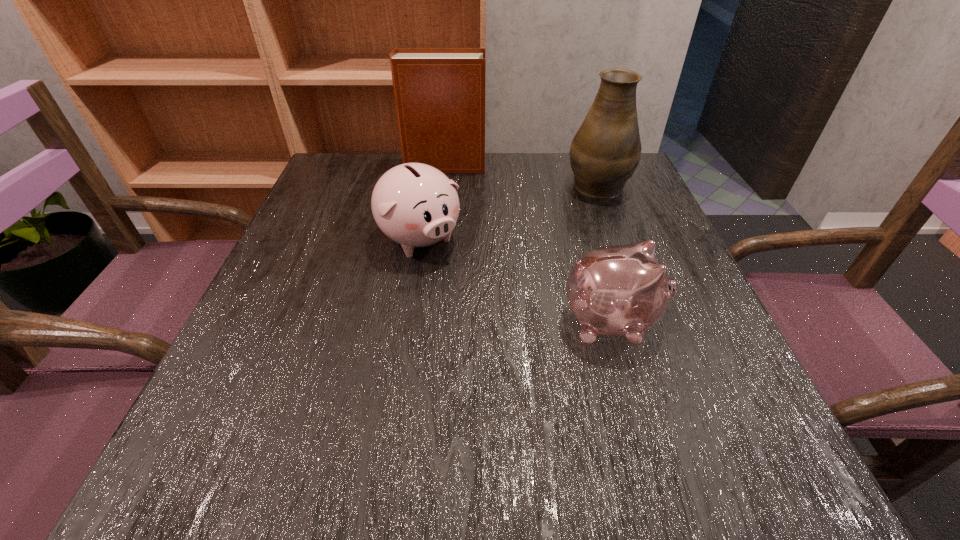
At what (x,y) coordinates should I click in order to perform the action: click on pitcher positioned at the right edge. Please return your answer as a coordinate pair (x, y). The height and width of the screenshot is (540, 960). Looking at the image, I should click on (605, 152).

Image resolution: width=960 pixels, height=540 pixels. What are the coordinates of `piggy bank present at the right edge` in the screenshot? It's located at pos(622,290).

Find the location of `object that is positioned at the far right corner`. object that is positioned at the far right corner is located at coordinates (605, 152).

In the image, there is a desktop. Where is `vacant region at the far edge`? vacant region at the far edge is located at coordinates pos(522,183).

Find the location of `vacant space at the near edge`. vacant space at the near edge is located at coordinates (647, 454).

Image resolution: width=960 pixels, height=540 pixels. In the image, there is a desktop. In order to click on vacant space at the left edge in this screenshot , I will do `click(236, 376)`.

Find the location of a particular element. free space at the right edge is located at coordinates (669, 397).

The height and width of the screenshot is (540, 960). I want to click on free point at the far left corner, so click(348, 183).

I want to click on blank region between the hardback book and the pitcher, so click(x=520, y=174).

What are the coordinates of `free spot between the nearest object and the hardback book` in the screenshot? It's located at (527, 244).